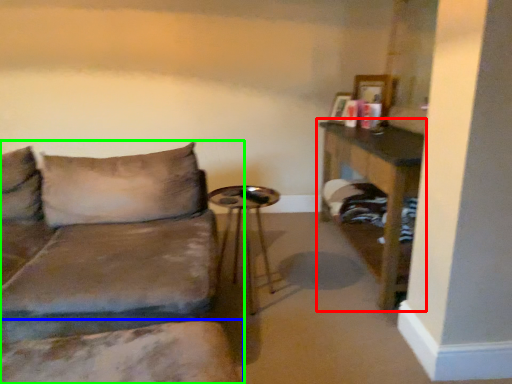
Question: Which is nearer to the table (highlighted by a red box)? swivel chair (highlighted by a blue box) or studio couch (highlighted by a green box).

Choices:
 (A) swivel chair
 (B) studio couch

Answer: (B)